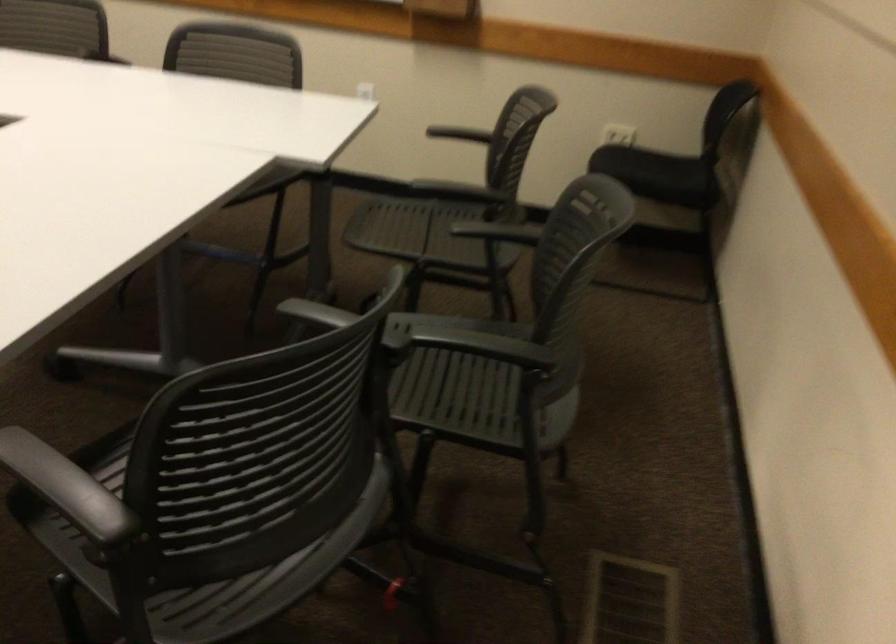
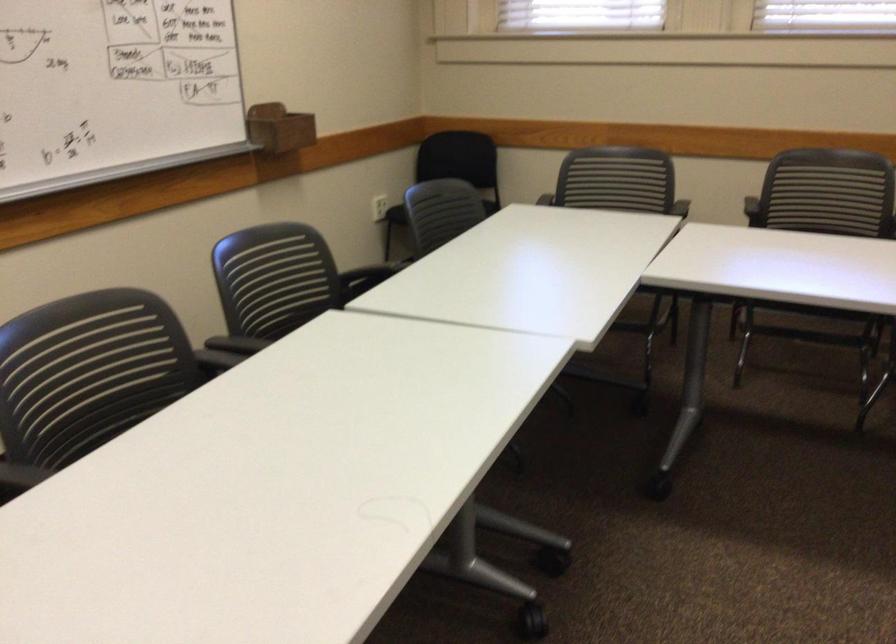
Question: I am providing you with two images of the same scene from different viewpoints. After the viewpoint changes to image2, which objects are now occluded?

Choices:
 (A) chair sitting surface
 (B) white toaster dial
 (C) wooden marker holder
 (D) black chair armrest

Answer: (D)